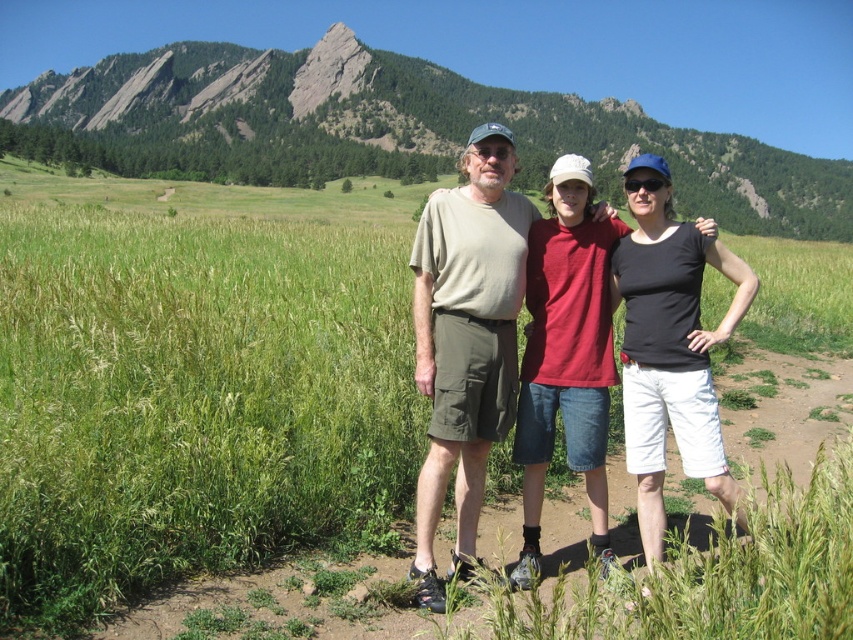
Between point (476, 348) and point (585, 168), which one is positioned behind?

The point (585, 168) is more distant.

Find the location of a particular element. The image size is (853, 640). matte khaki shorts at center is located at coordinates (467, 337).

Does green grassy field at upper center have a smaller size compared to matte khaki shorts at center?

Incorrect, green grassy field at upper center is not smaller in size than matte khaki shorts at center.

Find the location of a particular element. green grassy field at upper center is located at coordinates (396, 128).

Can you confirm if green grassy field at upper center is positioned to the right of matte black tank top at center?

In fact, green grassy field at upper center is to the left of matte black tank top at center.

Which is behind, point (364, 72) or point (531, 392)?

Positioned behind is point (364, 72).

Image resolution: width=853 pixels, height=640 pixels. Identify the location of green grassy field at upper center. (396, 128).